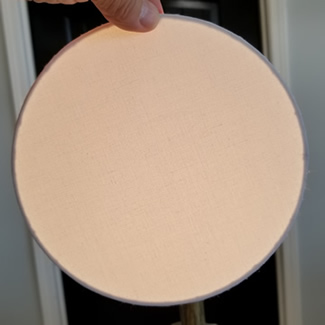
I want to click on opaque circular aida cross stitch fabric, so click(33, 104).